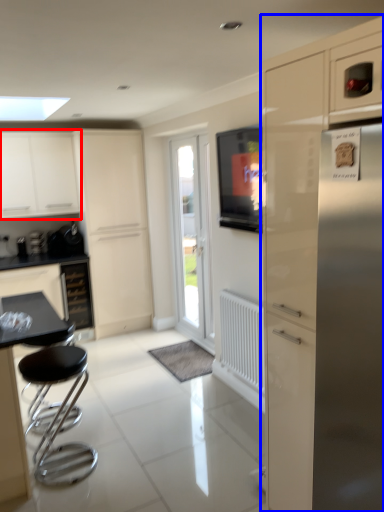
Question: Among these objects, which one is farthest to the camera, cabinetry (highlighted by a red box) or cabinetry (highlighted by a blue box)?

Choices:
 (A) cabinetry
 (B) cabinetry

Answer: (A)